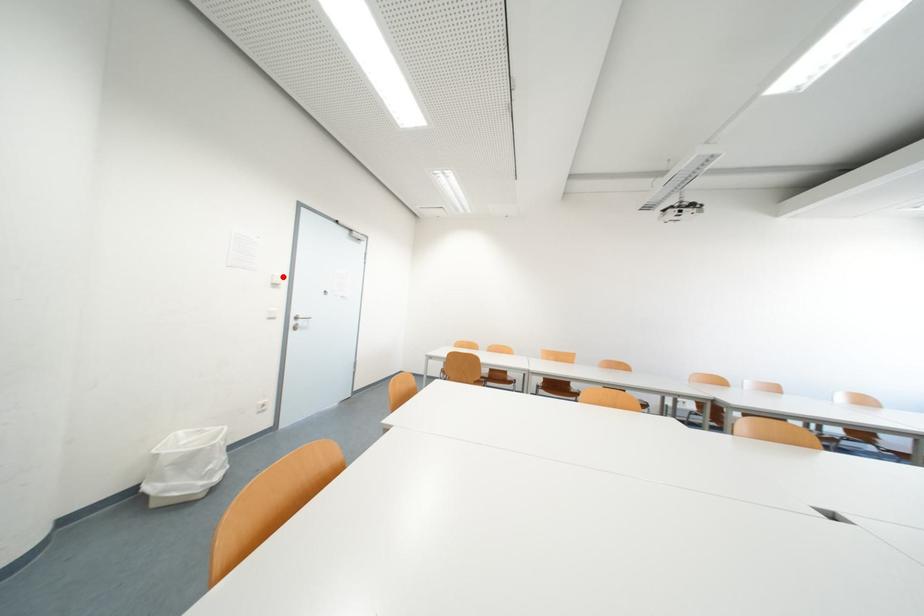
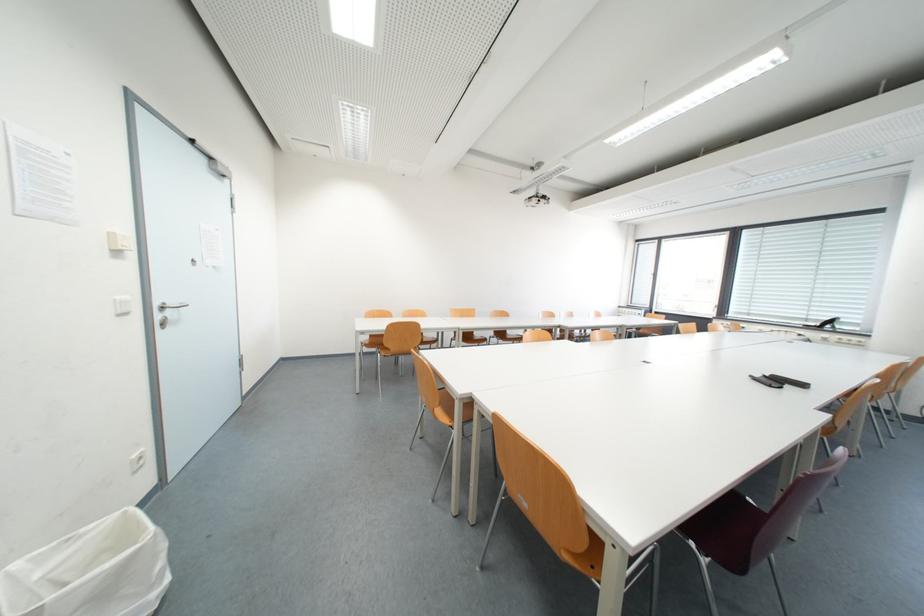
Locate, in the second image, the point that corresponds to the highlighted location in the first image.

(122, 236)